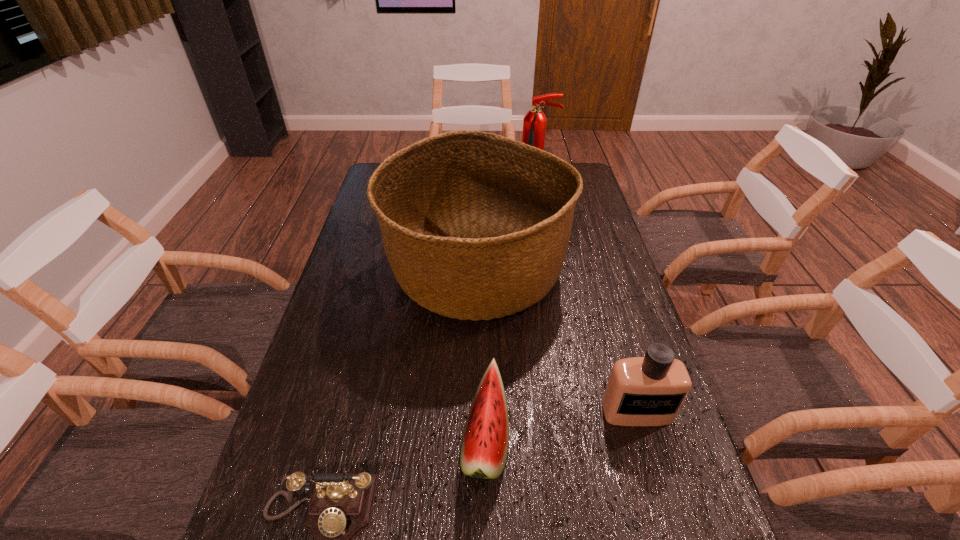
Locate an element on the screen. object situated at the far edge is located at coordinates coord(534,123).

I want to click on object present at the left edge, so click(475, 226).

Identify the location of fire extinguisher located in the right edge section of the desktop. The height and width of the screenshot is (540, 960). (534, 123).

Find the location of a particular element. The width and height of the screenshot is (960, 540). perfume situated at the right edge is located at coordinates (641, 391).

Locate an element on the screen. The height and width of the screenshot is (540, 960). object at the far right corner is located at coordinates click(x=534, y=123).

Image resolution: width=960 pixels, height=540 pixels. What are the coordinates of `free space at the left edge of the desktop` in the screenshot? It's located at tap(334, 437).

In the image, there is a desktop. Identify the location of free space at the right edge. (653, 462).

The height and width of the screenshot is (540, 960). In order to click on blank region between the farthest object and the third shortest object in this screenshot , I will do `click(587, 300)`.

I want to click on vacant space that's between the watermelon and the second farthest object, so click(481, 356).

In order to click on object that is the third closest to the basket in this screenshot , I will do `click(641, 391)`.